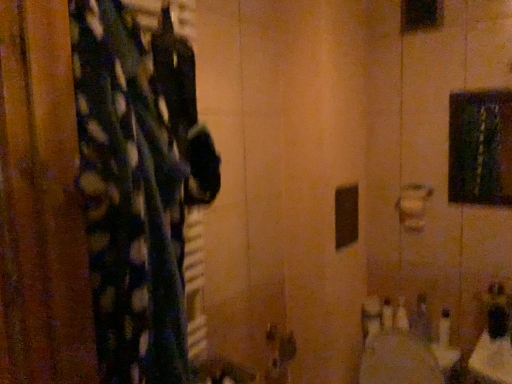
Question: Is white plastic bottles at lower right, marked as the 1th toiletry in a left-to-right arrangement, taller or shorter than fluffy polka dot fabric at left?

Choices:
 (A) tall
 (B) short

Answer: (B)

Question: From the image's perspective, is white plastic bottles at lower right, marked as the 1th toiletry in a left-to-right arrangement, located above or below fluffy polka dot fabric at left?

Choices:
 (A) below
 (B) above

Answer: (A)

Question: Which of these objects is positioned closest to the fluffy polka dot fabric at left?

Choices:
 (A) white plastic bottles at lower right, marked as the 1th toiletry in a left-to-right arrangement
 (B) metallic silver soap at lower right, the 2th toiletry positioned from the left

Answer: (B)

Question: Which object is positioned closest to the fluffy polka dot fabric at left?

Choices:
 (A) white plastic bottles at lower right, marked as the 1th toiletry in a left-to-right arrangement
 (B) metallic silver soap at lower right, which appears as the 1th toiletry when viewed from the right

Answer: (B)